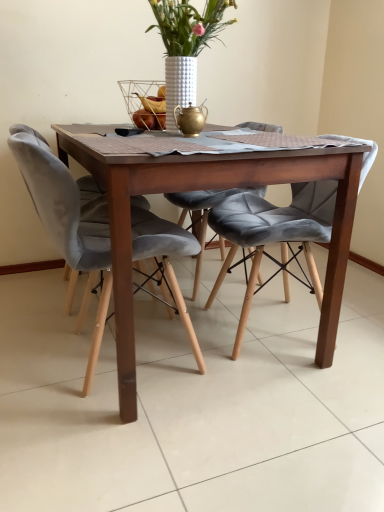
Describe the element at coordinates (205, 187) in the screenshot. I see `wooden table at center` at that location.

Image resolution: width=384 pixels, height=512 pixels. I want to click on velvet grey chair at left, the 1th chair in the left-to-right sequence, so click(x=68, y=217).

Identify the location of white textured vase at upper center. (186, 44).

Identify the location of wooden table at center. The height and width of the screenshot is (512, 384). (205, 187).

Which point is more forward, (115,224) or (98,264)?

The point (115,224) is closer to the camera.

Between wooden table at center and velvet grey chair at left, the 2th chair from the right, which one appears on the right side from the viewer's perspective?

Answer: Positioned to the right is wooden table at center.

Which object is more forward, wooden table at center or velvet grey chair at left, the 2th chair from the right?

wooden table at center.

Which is less distant, (x=227, y=205) or (x=87, y=212)?

Point (x=227, y=205) is farther from the camera than point (x=87, y=212).

The image size is (384, 512). I want to click on chair on the left of velvet grey chair at center, the second chair positioned from the left, so click(68, 217).

Which of these two, velvet grey chair at center, the first chair when ordered from right to left, or velvet grey chair at left, the 2th chair from the right, is wider?

velvet grey chair at center, the first chair when ordered from right to left.

Is velvet grey chair at center, the first chair when ordered from right to left, oriented towards white textured vase at upper center?

No, velvet grey chair at center, the first chair when ordered from right to left, does not turn towards white textured vase at upper center.

Does velvet grey chair at center, the first chair when ordered from right to left, have a greater height compared to white textured vase at upper center?

Yes.

What's the angular difference between velvet grey chair at center, the second chair positioned from the left, and white textured vase at upper center's facing directions?

They differ by 89.9 degrees in their facing directions.

From the image's perspective, which one is positioned lower, velvet grey chair at center, the first chair when ordered from right to left, or white textured vase at upper center?

velvet grey chair at center, the first chair when ordered from right to left.

Between point (179, 47) and point (90, 362), which one is positioned in front?

The point (90, 362) is in front.

Considering the sizes of white textured vase at upper center and velvet grey chair at left, the 2th chair from the right, in the image, is white textured vase at upper center wider or thinner than velvet grey chair at left, the 2th chair from the right,?

In the image, white textured vase at upper center appears to be more narrow than velvet grey chair at left, the 2th chair from the right.

Locate an element on the screen. houseplant that appears above the velvet grey chair at left, the 1th chair in the left-to-right sequence (from a real-world perspective) is located at coordinates (186, 44).

Are white textured vase at upper center and velvet grey chair at left, the 1th chair in the left-to-right sequence, far apart?

No.

Is wooden table at center inside or outside of velvet grey chair at center, the first chair when ordered from right to left?

wooden table at center is not inside velvet grey chair at center, the first chair when ordered from right to left, it's outside.

Which of these two, wooden table at center or velvet grey chair at center, the second chair positioned from the left, is smaller?

velvet grey chair at center, the second chair positioned from the left, is smaller.

Does wooden table at center have a greater height compared to velvet grey chair at center, the second chair positioned from the left?

Indeed, wooden table at center has a greater height compared to velvet grey chair at center, the second chair positioned from the left.

Are wooden table at center and velvet grey chair at center, the first chair when ordered from right to left, beside each other?

wooden table at center and velvet grey chair at center, the first chair when ordered from right to left, are not in contact.

From a real-world perspective, which object stands above the other?

From a 3D spatial view, white textured vase at upper center is above.

Where is `houseplant lying above the wooden table at center (from the image's perspective)`? This screenshot has height=512, width=384. houseplant lying above the wooden table at center (from the image's perspective) is located at coordinates (186, 44).

Does wooden table at center have a larger size compared to white textured vase at upper center?

Correct, wooden table at center is larger in size than white textured vase at upper center.

Is wooden table at center turned away from white textured vase at upper center?

No, wooden table at center's orientation is not away from white textured vase at upper center.

From the image's perspective, which is above, white textured vase at upper center or velvet grey chair at center, the first chair when ordered from right to left?

white textured vase at upper center appears higher in the image.

Which is more to the left, white textured vase at upper center or velvet grey chair at center, the second chair positioned from the left?

white textured vase at upper center.

Does white textured vase at upper center have a greater width compared to velvet grey chair at center, the first chair when ordered from right to left?

Incorrect, the width of white textured vase at upper center does not surpass that of velvet grey chair at center, the first chair when ordered from right to left.

What are the coordinates of `kitchen & dining room table on the right of velvet grey chair at left, the 1th chair in the left-to-right sequence` in the screenshot? It's located at (205, 187).

Locate an element on the screen. Image resolution: width=384 pixels, height=512 pixels. chair beneath the velvet grey chair at left, the 2th chair from the right (from a real-world perspective) is located at coordinates (273, 231).

Which object lies further to the anchor point velvet grey chair at center, the second chair positioned from the left, white textured vase at upper center or wooden table at center?

The object further to velvet grey chair at center, the second chair positioned from the left, is white textured vase at upper center.

Based on their spatial positions, is velvet grey chair at left, the 2th chair from the right, or velvet grey chair at center, the second chair positioned from the left, closer to white textured vase at upper center?

Among the two, velvet grey chair at center, the second chair positioned from the left, is located nearer to white textured vase at upper center.

Estimate the real-world distances between objects in this image. Which object is further from velvet grey chair at left, the 2th chair from the right, velvet grey chair at center, the second chair positioned from the left, or white textured vase at upper center?

white textured vase at upper center is further to velvet grey chair at left, the 2th chair from the right.

Estimate the real-world distances between objects in this image. Which object is closer to wooden table at center, velvet grey chair at left, the 1th chair in the left-to-right sequence, or velvet grey chair at center, the first chair when ordered from right to left?

velvet grey chair at left, the 1th chair in the left-to-right sequence, lies closer to wooden table at center than the other object.

When comparing their distances from wooden table at center, does velvet grey chair at left, the 1th chair in the left-to-right sequence, or white textured vase at upper center seem closer?

velvet grey chair at left, the 1th chair in the left-to-right sequence, is closer to wooden table at center.

Based on their spatial positions, is white textured vase at upper center or velvet grey chair at left, the 2th chair from the right, closer to velvet grey chair at center, the second chair positioned from the left?

velvet grey chair at left, the 2th chair from the right, is closer to velvet grey chair at center, the second chair positioned from the left.

Considering their positions, is wooden table at center positioned further to velvet grey chair at center, the second chair positioned from the left, than velvet grey chair at left, the 1th chair in the left-to-right sequence?

velvet grey chair at left, the 1th chair in the left-to-right sequence, lies further to velvet grey chair at center, the second chair positioned from the left, than the other object.

In the scene shown: Considering their positions, is white textured vase at upper center positioned further to wooden table at center than velvet grey chair at left, the 2th chair from the right?

white textured vase at upper center is further to wooden table at center.

Where is `kitchen & dining room table between white textured vase at upper center and velvet grey chair at center, the first chair when ordered from right to left, vertically`? kitchen & dining room table between white textured vase at upper center and velvet grey chair at center, the first chair when ordered from right to left, vertically is located at coordinates (205, 187).

Image resolution: width=384 pixels, height=512 pixels. Find the location of `chair that lies between white textured vase at upper center and velvet grey chair at left, the 2th chair from the right, from top to bottom`. chair that lies between white textured vase at upper center and velvet grey chair at left, the 2th chair from the right, from top to bottom is located at coordinates (273, 231).

Image resolution: width=384 pixels, height=512 pixels. Identify the location of kitchen & dining room table between white textured vase at upper center and velvet grey chair at left, the 2th chair from the right, in the up-down direction. (205, 187).

You are a GUI agent. You are given a task and a screenshot of the screen. Output one action in this format:
    pyautogui.click(x=<x>, y=<y>)
    Task: Click on the kitchen & dining room table between velvet grey chair at left, the 2th chair from the right, and velvet grey chair at center, the first chair when ordered from right to left, in the horizontal direction
    This screenshot has height=512, width=384.
    Given the screenshot: What is the action you would take?
    pyautogui.click(x=205, y=187)